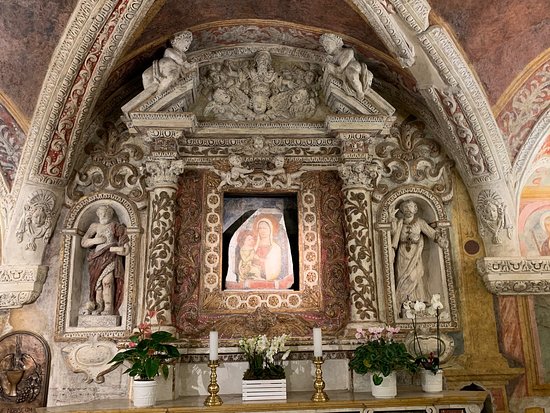
I want to click on candlesticks, so [x=316, y=349], [x=214, y=349].